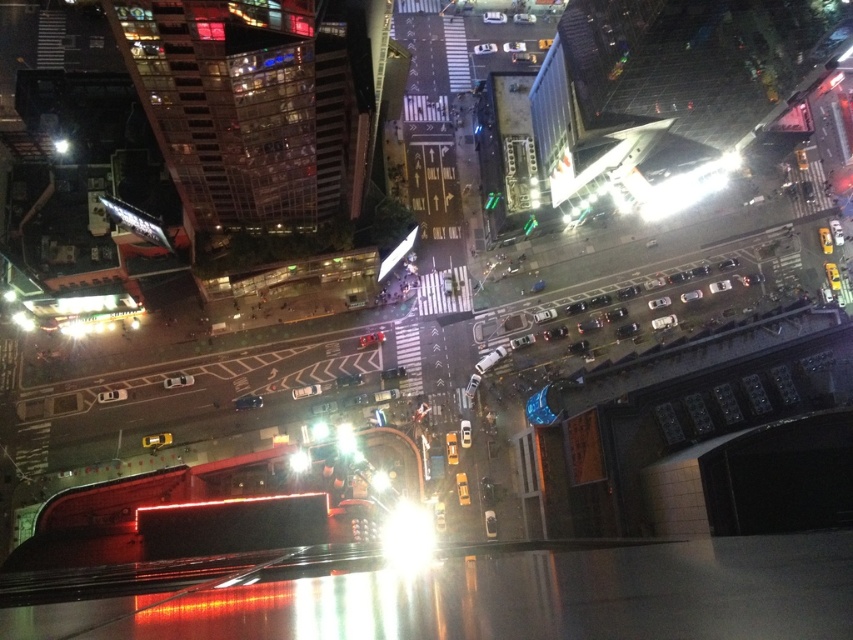
Question: Can you confirm if transparent glass light at center is positioned above shiny black car at center?

Choices:
 (A) yes
 (B) no

Answer: (B)

Question: Which of the following is the farthest from the observer?

Choices:
 (A) (296, 472)
 (B) (408, 525)

Answer: (B)

Question: Where is bright white light at center located in relation to bright metallic light at center in the image?

Choices:
 (A) right
 (B) left

Answer: (A)

Question: Is bright white light at center smaller than bright metallic light at center?

Choices:
 (A) yes
 (B) no

Answer: (B)

Question: Estimate the real-world distances between objects in this image. Which object is farther from the bright white light at center?

Choices:
 (A) transparent glass light at center
 (B) bright metallic light at center

Answer: (B)

Question: Which of the following is the closest to the observer?

Choices:
 (A) bright white light at center
 (B) bright metallic light at center
 (C) shiny black car at center
 (D) transparent glass light at center

Answer: (A)